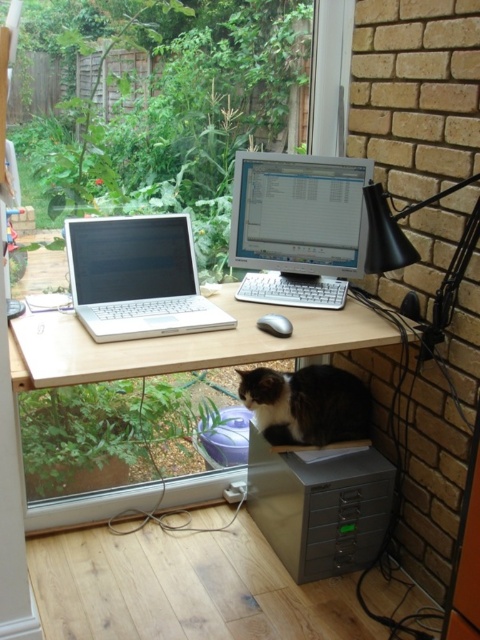
Question: Does matte silver monitor at center appear under fluffy black-and-white cat at center?

Choices:
 (A) no
 (B) yes

Answer: (A)

Question: Observing the image, what is the correct spatial positioning of white wooden computer desk at center in reference to black matte lamp at upper right?

Choices:
 (A) left
 (B) right

Answer: (A)

Question: Is white wooden computer desk at center further to the viewer compared to matte silver monitor at center?

Choices:
 (A) yes
 (B) no

Answer: (B)

Question: Which of the following is the farthest from the observer?

Choices:
 (A) (369, 340)
 (B) (328, 480)
 (C) (418, 202)

Answer: (B)

Question: Considering the real-world distances, which object is farthest from the fluffy black-and-white cat at center?

Choices:
 (A) white wooden computer desk at center
 (B) metallic gray file cabinet at lower right

Answer: (A)

Question: Which point is farther to the camera?

Choices:
 (A) (58, 371)
 (B) (295, 176)

Answer: (B)